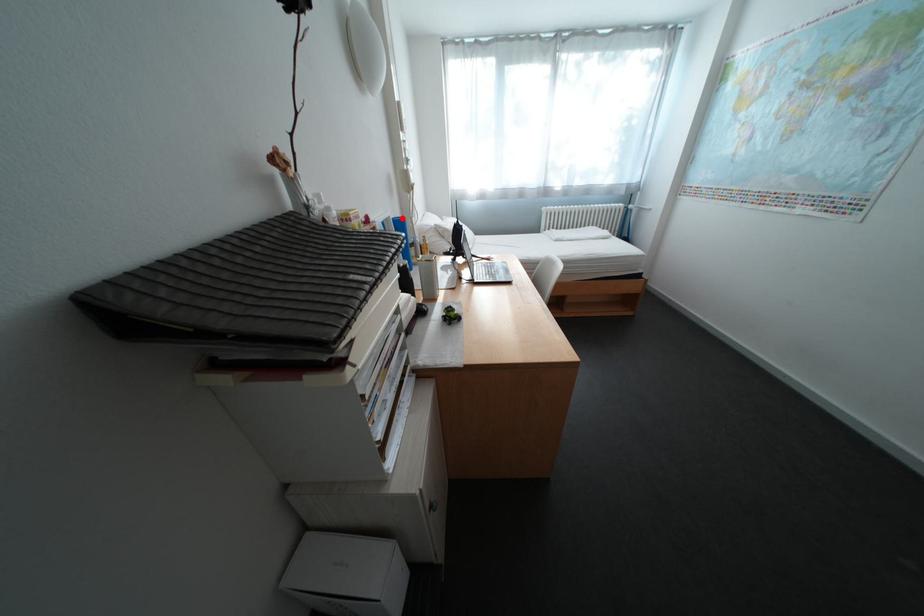
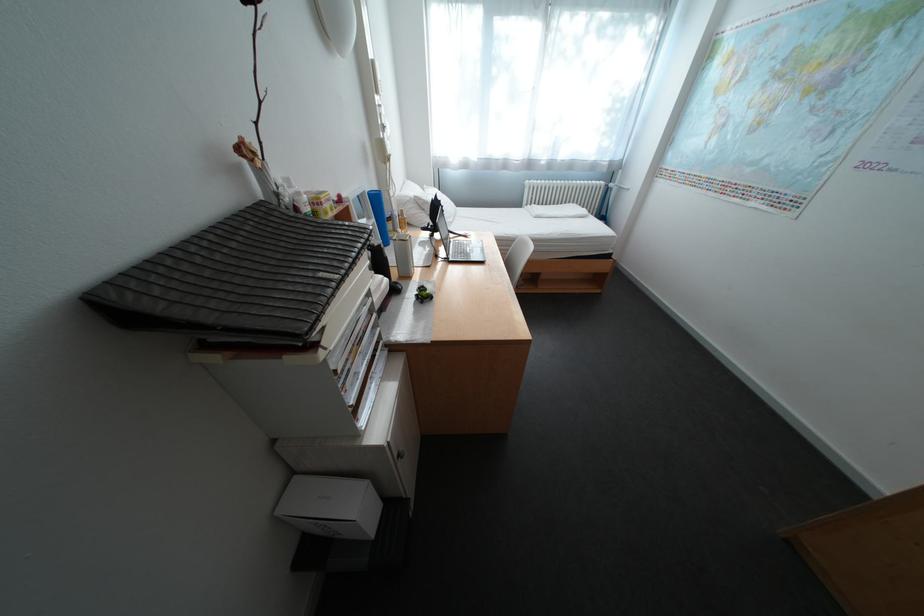
Find the pixel in the second image that matches the highlighted location in the first image.

(378, 192)